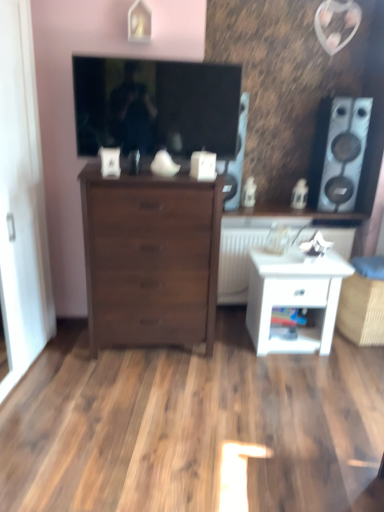
Locate an element on the screen. Image resolution: width=384 pixels, height=512 pixels. vacant region in front of white glossy nightstand at lower right is located at coordinates (298, 374).